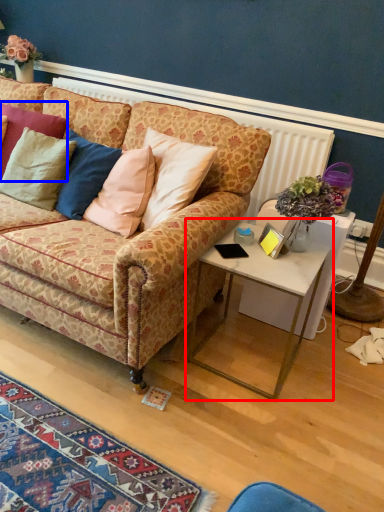
Question: Which of the following is the farthest to the observer, table (highlighted by a red box) or pillow (highlighted by a blue box)?

Choices:
 (A) table
 (B) pillow

Answer: (B)